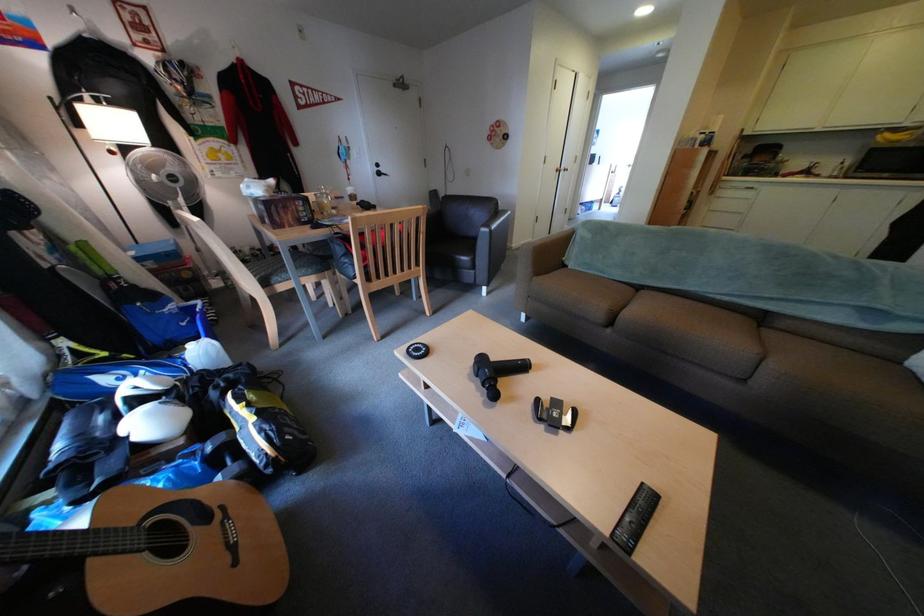
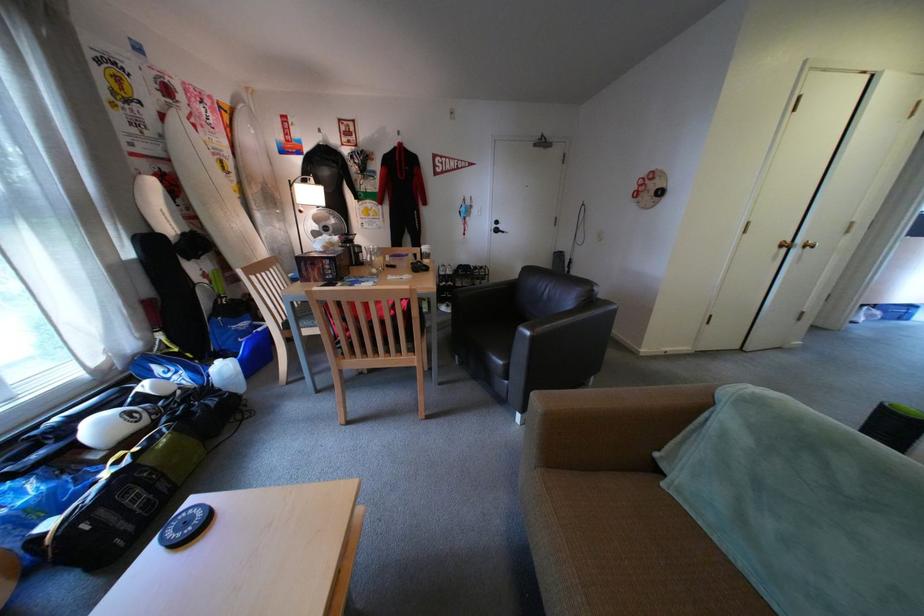
Find the pixel in the second image that matches [337,339] in the first image.

(333, 392)